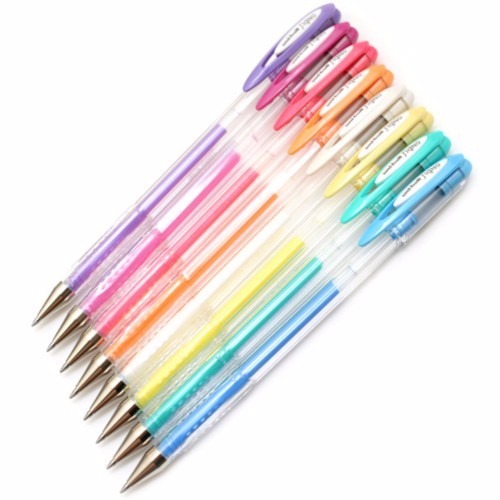
Find the location of a particular element. The image size is (500, 500). plastic gel pen caps is located at coordinates (326, 12), (348, 30), (369, 54), (384, 77), (404, 99), (425, 121), (444, 144), (466, 167).